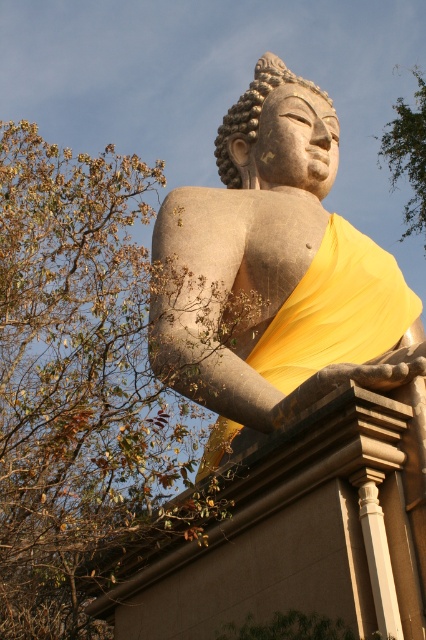
You are standing in front of the seated Buddha statue and want to take a photo that includes both the statue and the brown leafy tree at upper left. Based on their positions, where should you aim your camera to capture both elements in the frame?

To capture both the seated Buddha statue and the brown leafy tree at upper left in the frame, aim your camera towards the upper left area since the brown leafy tree at upper left is positioned at point (80, 384), which is in the upper left quadrant of the scene.

In the scene shown: You are standing in front of the statue and want to take a photo that includes both the brown leafy tree at upper left and the matte stone buddha at center. Which object is positioned higher in the frame?

The brown leafy tree at upper left is positioned above the matte stone buddha at center, so it is higher in the frame.

You are standing in front of the statue and want to take a photo of the matte stone buddha at center. If your camera has a maximum focus range of 150 feet, will you be able to capture a clear photo?

The matte stone buddha at center is 158.01 feet away from the viewer, which exceeds the camera maximum focus range of 150 feet. Therefore, the camera cannot focus on the statue and a clear photo cannot be captured.